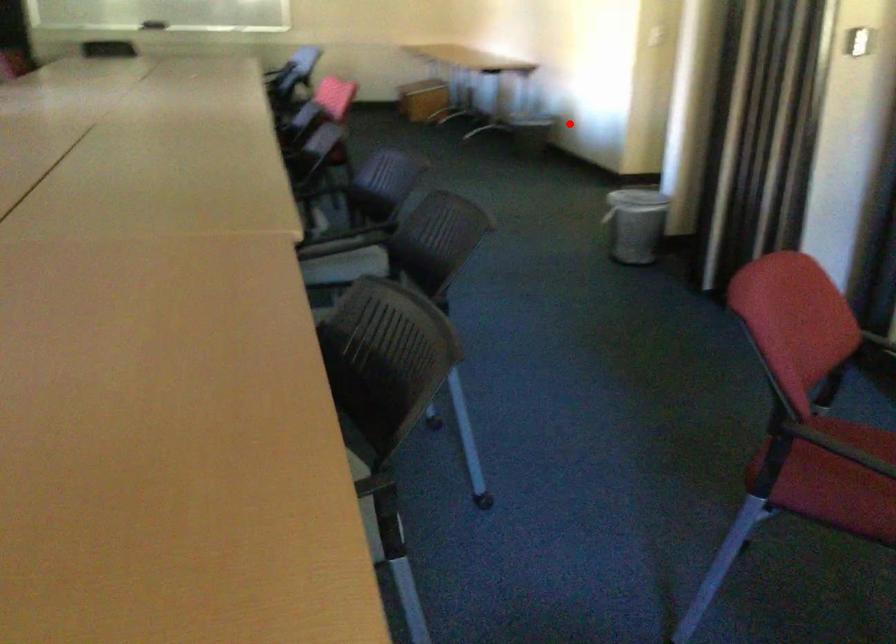
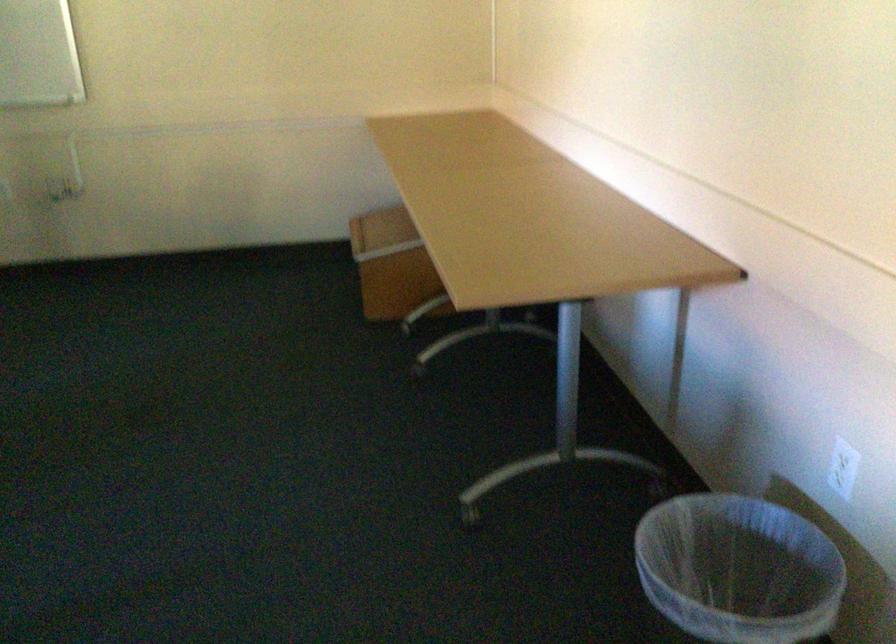
The point at the highlighted location is marked in the first image. Where is the corresponding point in the second image?

(737, 569)